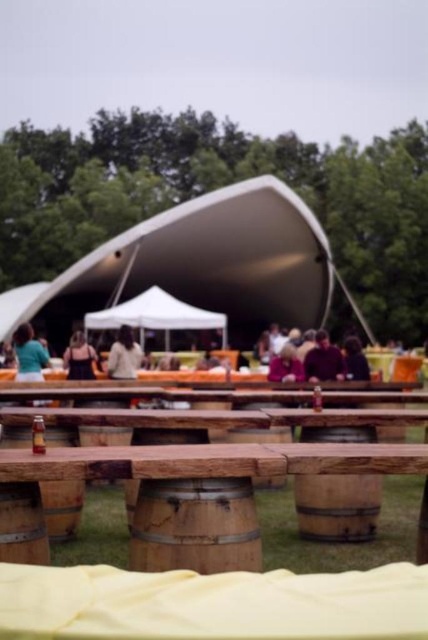
Question: Is brown wooden barrel at lower left thinner than matte black dress at center?

Choices:
 (A) yes
 (B) no

Answer: (A)

Question: Can you confirm if rustic wood barrel at lower center is wider than dark brown leather jacket at center?

Choices:
 (A) no
 (B) yes

Answer: (A)

Question: Which of the following is the closest to the observer?

Choices:
 (A) dark brown leather jacket at center
 (B) light beige sweater at center
 (C) brown wooden barrel at lower left
 (D) wooden barrel at center

Answer: (C)

Question: Considering the real-world distances, which object is farthest from the matte black dress at center?

Choices:
 (A) brown wooden barrel at lower left
 (B) rustic wood barrel at lower center
 (C) wooden barrel at center
 (D) rustic wood table at center

Answer: (D)

Question: Does wooden barrel at center have a greater width compared to dark brown leather jacket at center?

Choices:
 (A) no
 (B) yes

Answer: (A)

Question: Which object appears closest to the camera in this image?

Choices:
 (A) brown wooden barrel at lower left
 (B) matte black dress at center
 (C) rustic wood barrel at lower center

Answer: (A)